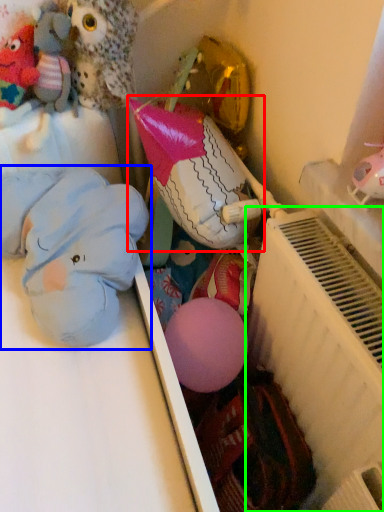
Question: Which object is the closest to the toy (highlighted by a red box)? Choose among these: toy (highlighted by a blue box) or radiator (highlighted by a green box).

Choices:
 (A) toy
 (B) radiator

Answer: (A)